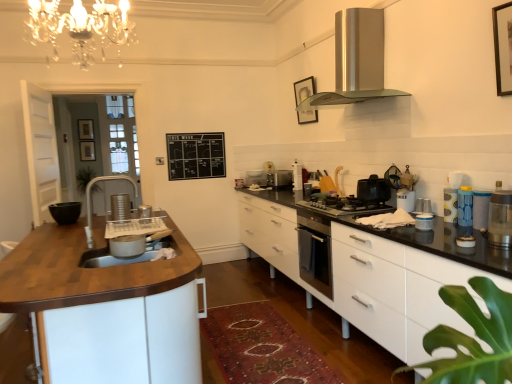
Locate an element on the screen. free region on the left part of metallic silver toaster at upper right, the 4th appliance viewed from the right is located at coordinates (400, 212).